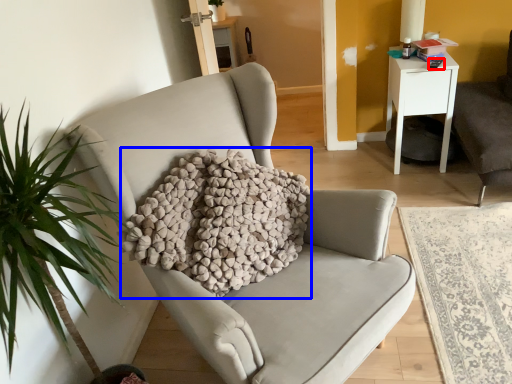
Question: Which of the following is the farthest to the observer, remote control (highlighted by a red box) or pillow (highlighted by a blue box)?

Choices:
 (A) remote control
 (B) pillow

Answer: (A)